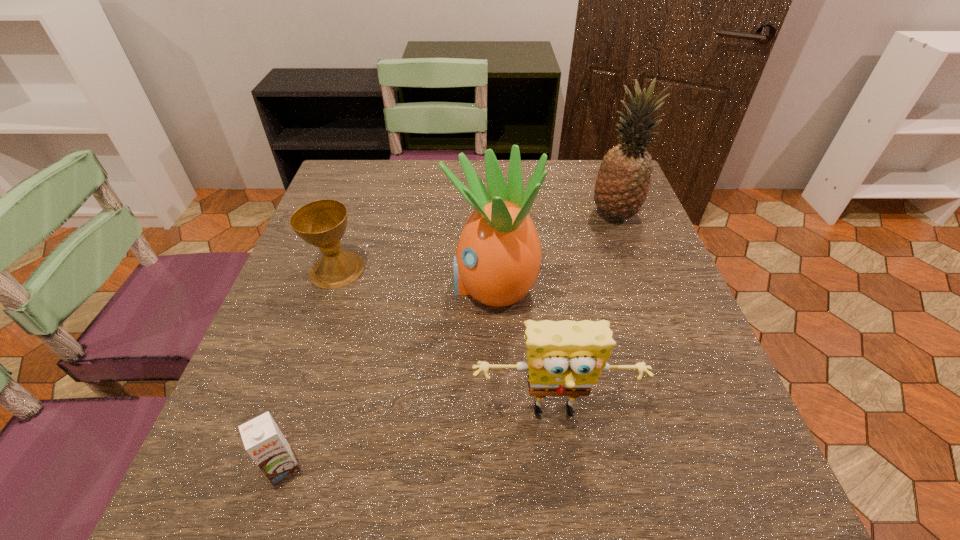
At what (x,y) coordinates should I click in order to perform the action: click on free spot that satisfies the following two spatial constraints: 1. on the front side of the farther pineapple; 2. at the entrance of the nearer pineapple. Please return your answer as a coordinate pair (x, y). The image size is (960, 540). Looking at the image, I should click on (640, 285).